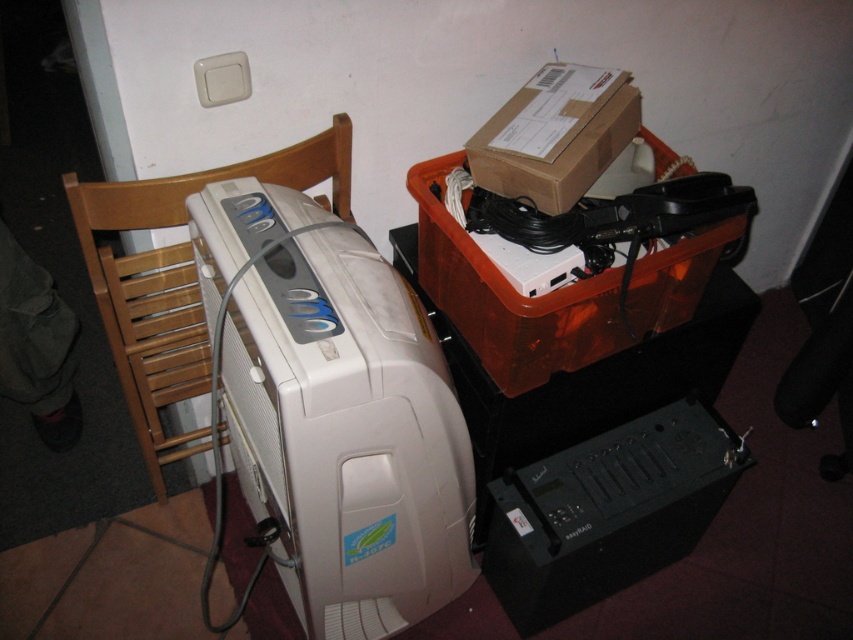
You are organizing the clutter in the room and need to place the white plastic printer at left and the brown cardboard box at upper right on a shelf. The shelf has a height limit of 1 meter. Can both items fit vertically without exceeding the height limit?

The white plastic printer at left is much taller than the brown cardboard box at upper right. Since the shelf has a height limit of 1 meter, both items can fit vertically as long as the printer does not exceed the limit. However, if the printer itself is taller than 1 meter, it would not fit. The description only states the printer is taller than the box, but does not specify exact measurements. Without knowing the exact height of the printer, it is uncertain if both can fit within the 1 meter limit.

You are organizing the clutter in the room and need to move the wooden at left and the brown cardboard box at upper right. Which object should you move first to access the other?

You should move the wooden at left first because it is positioned to the left of the brown cardboard box at upper right, meaning it is blocking access to the box.